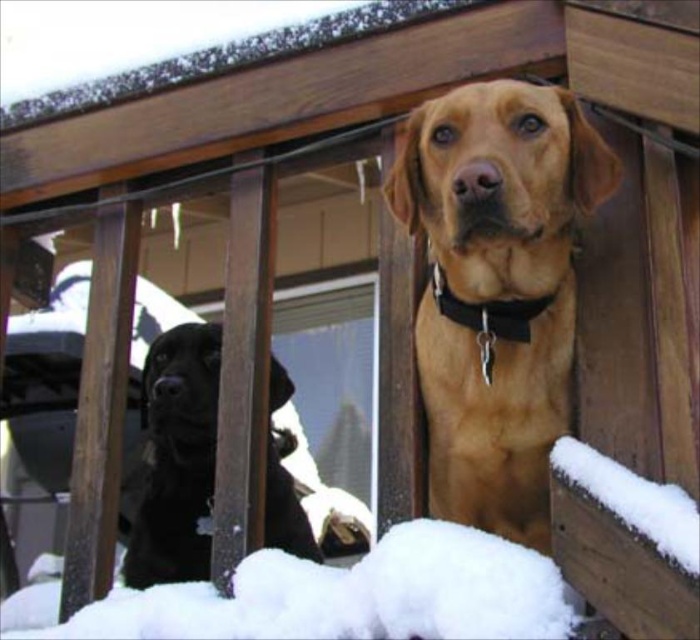
Does white fluffy snow at lower center appear on the left side of shiny black dog at left?

No, white fluffy snow at lower center is not to the left of shiny black dog at left.

This screenshot has width=700, height=640. I want to click on white fluffy snow at lower center, so click(336, 595).

Is point (336, 624) farther from camera compared to point (281, 520)?

No, (336, 624) is in front of (281, 520).

The width and height of the screenshot is (700, 640). I want to click on white fluffy snow at lower center, so click(x=336, y=595).

You are a GUI agent. You are given a task and a screenshot of the screen. Output one action in this format:
    pyautogui.click(x=<x>, y=<y>)
    Task: Click on the golden fur dog at center
    
    Given the screenshot: What is the action you would take?
    pyautogui.click(x=497, y=289)

Is golden fur dog at center to the right of shiny black dog at left from the viewer's perspective?

Indeed, golden fur dog at center is positioned on the right side of shiny black dog at left.

Between point (462, 257) and point (133, 513), which one is positioned in front?

Point (462, 257) is more forward.

Where is `golden fur dog at center`? The image size is (700, 640). golden fur dog at center is located at coordinates (497, 289).

Is golden fur dog at center to the left of black matte neckband at center from the viewer's perspective?

Indeed, golden fur dog at center is positioned on the left side of black matte neckband at center.

Can you confirm if golden fur dog at center is thinner than black matte neckband at center?

Incorrect, golden fur dog at center's width is not less than black matte neckband at center's.

The image size is (700, 640). What are the coordinates of `golden fur dog at center` in the screenshot? It's located at (497, 289).